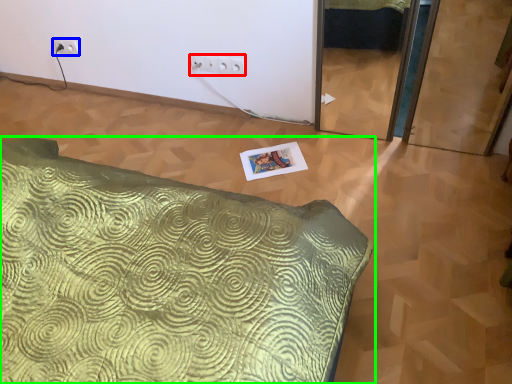
Question: Based on their relative distances, which object is nearer to electric outlet (highlighted by a red box)? Choose from electric outlet (highlighted by a blue box) and bed (highlighted by a green box).

Choices:
 (A) electric outlet
 (B) bed

Answer: (A)